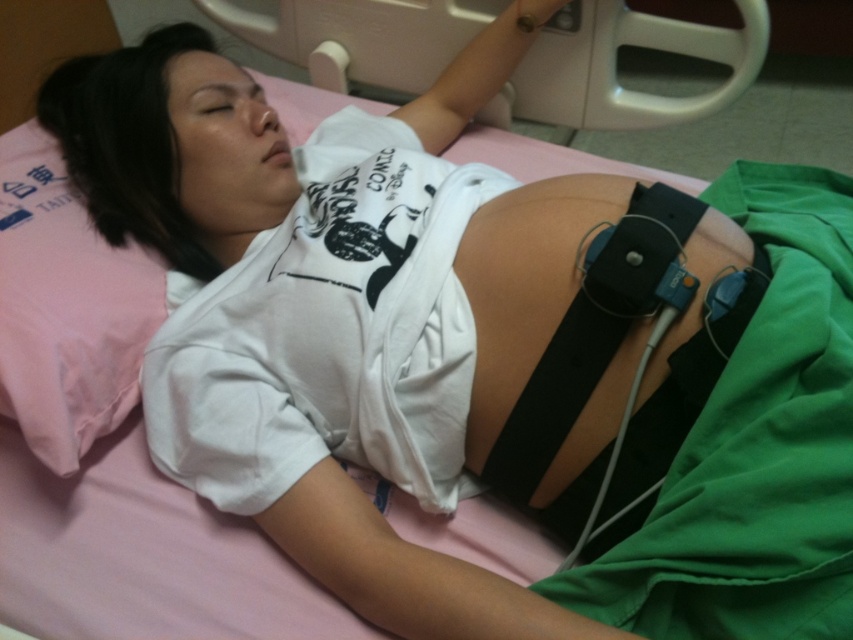
Question: Is black rubber belt at upper center to the left of pink fabric pillow at left from the viewer's perspective?

Choices:
 (A) yes
 (B) no

Answer: (B)

Question: Which object is farther from the camera taking this photo?

Choices:
 (A) pink fabric pillow at left
 (B) black rubber belt at upper center

Answer: (B)

Question: Is black rubber belt at upper center bigger than pink fabric pillow at left?

Choices:
 (A) no
 (B) yes

Answer: (B)

Question: Can you confirm if black rubber belt at upper center is positioned below pink fabric pillow at left?

Choices:
 (A) yes
 (B) no

Answer: (B)